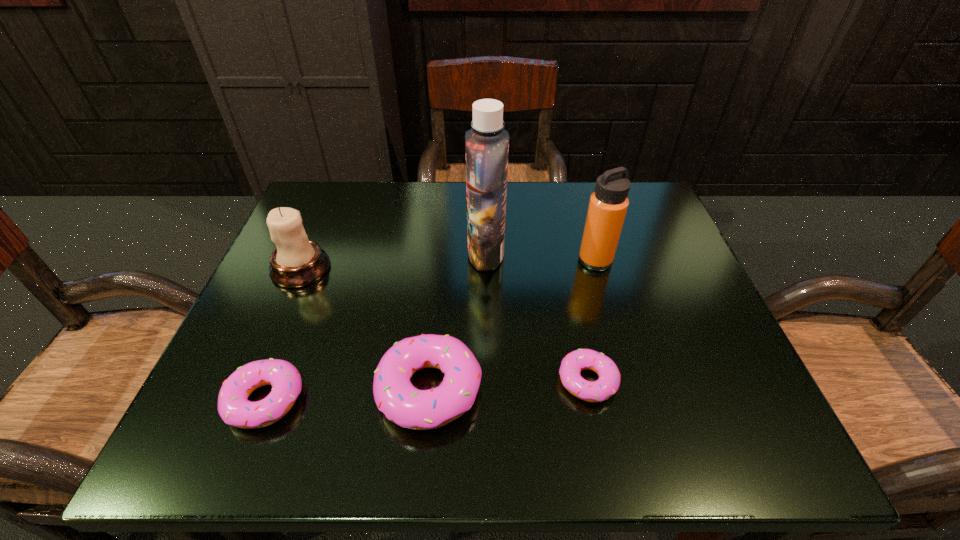
Image resolution: width=960 pixels, height=540 pixels. Find the location of `object at the right edge`. object at the right edge is located at coordinates (608, 205).

You are a GUI agent. You are given a task and a screenshot of the screen. Output one action in this format:
    pyautogui.click(x=<x>, y=<y>)
    Task: Click on the object at the near left corner
    The image size is (960, 540).
    Given the screenshot: What is the action you would take?
    pyautogui.click(x=235, y=409)

Locate an element on the screen. free location at the far edge of the desktop is located at coordinates (386, 189).

The image size is (960, 540). In order to click on blank area at the left edge in this screenshot , I will do `click(306, 320)`.

In the image, there is a desktop. At what (x,y) coordinates should I click in order to perform the action: click on free space at the right edge. Please return your answer as a coordinate pair (x, y). Looking at the image, I should click on (646, 351).

The width and height of the screenshot is (960, 540). I want to click on free space at the far left corner of the desktop, so click(334, 185).

Where is `vacant region at the far right corner of the desktop`? This screenshot has width=960, height=540. vacant region at the far right corner of the desktop is located at coordinates (654, 231).

Identify the location of free space between the tallest object and the rightmost doughnut. (537, 317).

You are a GUI agent. You are given a task and a screenshot of the screen. Output one action in this format:
    pyautogui.click(x=<x>, y=<y>)
    Task: Click on the free space that is in between the tallest object and the candle holder
    
    Given the screenshot: What is the action you would take?
    pyautogui.click(x=394, y=260)

Find the location of `vacant space in between the second shortest doughnut and the fourth shortest object`. vacant space in between the second shortest doughnut and the fourth shortest object is located at coordinates (283, 334).